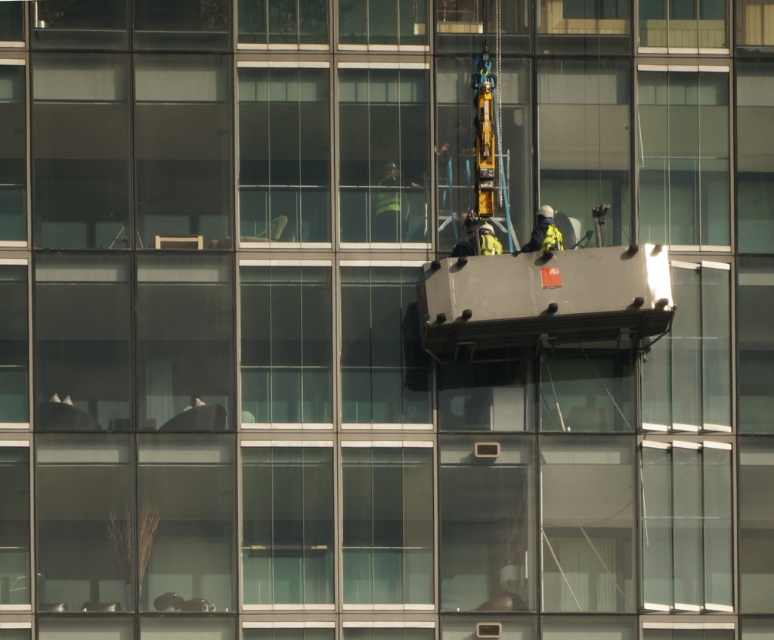
Which of these two, reflective silver helmet at center or yellow reflective vest at center, stands shorter?

reflective silver helmet at center

What do you see at coordinates (475, 237) in the screenshot? The height and width of the screenshot is (640, 774). I see `reflective silver helmet at center` at bounding box center [475, 237].

Where is `reflective silver helmet at center`? This screenshot has height=640, width=774. reflective silver helmet at center is located at coordinates (475, 237).